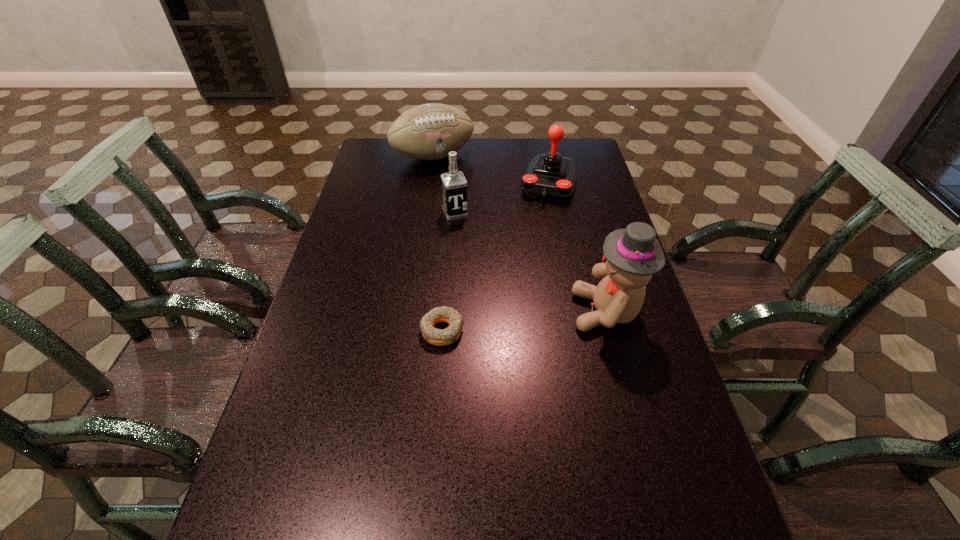
Where is `vacant region at the far right corner of the desktop`? The height and width of the screenshot is (540, 960). vacant region at the far right corner of the desktop is located at coordinates (581, 150).

In the image, there is a desktop. Find the location of `vacant space at the near right corner`. vacant space at the near right corner is located at coordinates (633, 487).

Where is `empty space that is in between the rag_doll and the shortest object`? Image resolution: width=960 pixels, height=540 pixels. empty space that is in between the rag_doll and the shortest object is located at coordinates (524, 321).

Locate an element on the screen. Image resolution: width=960 pixels, height=540 pixels. free point between the doughnut and the football (American) is located at coordinates (438, 244).

You are a GUI agent. You are given a task and a screenshot of the screen. Output one action in this format:
    pyautogui.click(x=<x>, y=<y>)
    Task: Click on the vacant space that's between the joystick and the vodka
    
    Given the screenshot: What is the action you would take?
    pyautogui.click(x=502, y=199)

The height and width of the screenshot is (540, 960). I want to click on vacant area that lies between the rag_doll and the joystick, so click(x=578, y=248).

Find the location of `vacant area that lies between the joystick and the football (American)`. vacant area that lies between the joystick and the football (American) is located at coordinates (492, 171).

Where is `vacant area that lies between the doughnut and the joystick`? The width and height of the screenshot is (960, 540). vacant area that lies between the doughnut and the joystick is located at coordinates (495, 258).

At what (x,y) coordinates should I click in order to perform the action: click on free spot between the football (American) and the tallest object. Please return your answer as a coordinate pair (x, y). The width and height of the screenshot is (960, 540). Looking at the image, I should click on (520, 234).

Where is `blank region between the shortest object and the tallest object`? blank region between the shortest object and the tallest object is located at coordinates (524, 321).